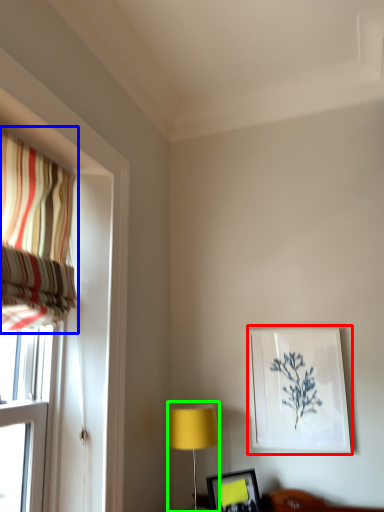
Question: Which is farther away from picture frame (highlighted by a red box)? curtain (highlighted by a blue box) or table lamp (highlighted by a green box)?

Choices:
 (A) curtain
 (B) table lamp

Answer: (A)